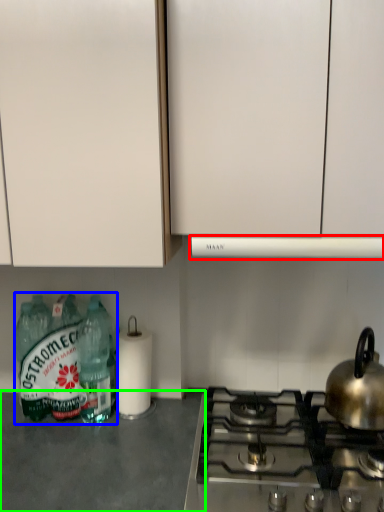
Question: Considering the real-world distances, which object is farthest from vent (highlighted by a red box)? bottle (highlighted by a blue box) or counter top (highlighted by a green box)?

Choices:
 (A) bottle
 (B) counter top

Answer: (B)